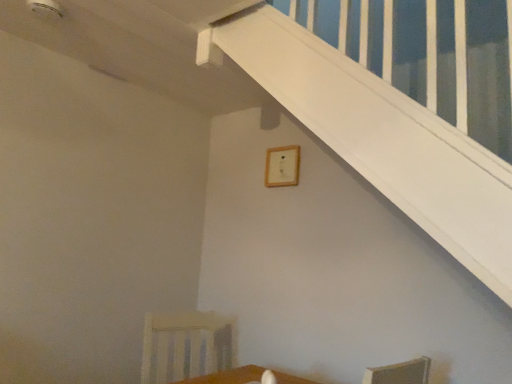
The height and width of the screenshot is (384, 512). Describe the element at coordinates (282, 166) in the screenshot. I see `wooden frame at upper center` at that location.

The image size is (512, 384). I want to click on wooden frame at upper center, so [282, 166].

I want to click on white wood armchair at lower left, so click(185, 346).

Image resolution: width=512 pixels, height=384 pixels. What do you see at coordinates (185, 346) in the screenshot?
I see `white wood armchair at lower left` at bounding box center [185, 346].

The image size is (512, 384). Find the location of `wooden frame at upper center`. wooden frame at upper center is located at coordinates (282, 166).

Based on their positions, is white wood armchair at lower left located to the left or right of wooden frame at upper center?

Based on their positions, white wood armchair at lower left is located to the left of wooden frame at upper center.

Considering the relative positions of white wood armchair at lower left and wooden frame at upper center in the image provided, is white wood armchair at lower left in front of wooden frame at upper center?

Yes, white wood armchair at lower left is closer to the viewer.

Considering the positions of point (214, 342) and point (279, 169), is point (214, 342) closer or farther from the camera than point (279, 169)?

Point (214, 342) is positioned farther from the camera compared to point (279, 169).

From the image's perspective, is white wood armchair at lower left above or below wooden frame at upper center?

white wood armchair at lower left is situated lower than wooden frame at upper center in the image.

From a real-world perspective, is white wood armchair at lower left above or below wooden frame at upper center?

Clearly, from a real-world perspective, white wood armchair at lower left is below wooden frame at upper center.

Based on the photo, between white wood armchair at lower left and wooden frame at upper center, which one has smaller width?

wooden frame at upper center is thinner.

Is white wood armchair at lower left taller or shorter than wooden frame at upper center?

Clearly, white wood armchair at lower left is taller compared to wooden frame at upper center.

Does white wood armchair at lower left have a smaller size compared to wooden frame at upper center?

Incorrect, white wood armchair at lower left is not smaller in size than wooden frame at upper center.

Do you think white wood armchair at lower left is within wooden frame at upper center, or outside of it?

The correct answer is: outside.

Would you say white wood armchair at lower left is a long distance from wooden frame at upper center?

That's right, there is a large distance between white wood armchair at lower left and wooden frame at upper center.

Is white wood armchair at lower left facing towards wooden frame at upper center?

No, white wood armchair at lower left is not facing towards wooden frame at upper center.

Where is `armchair below the wooden frame at upper center (from the image's perspective)`? The image size is (512, 384). armchair below the wooden frame at upper center (from the image's perspective) is located at coordinates (185, 346).

Is wooden frame at upper center to the left of white wood armchair at lower left from the viewer's perspective?

No.

Which object is further away from the camera, wooden frame at upper center or white wood armchair at lower left?

wooden frame at upper center is behind.

Which is closer, [298,157] or [225,324]?

Point [298,157].

From the image's perspective, is wooden frame at upper center above or below white wood armchair at lower left?

wooden frame at upper center is situated higher than white wood armchair at lower left in the image.

From a real-world perspective, who is located higher, wooden frame at upper center or white wood armchair at lower left?

wooden frame at upper center is physically above.

Considering the relative sizes of wooden frame at upper center and white wood armchair at lower left in the image provided, is wooden frame at upper center wider than white wood armchair at lower left?

No, wooden frame at upper center is not wider than white wood armchair at lower left.

Who is shorter, wooden frame at upper center or white wood armchair at lower left?

With less height is wooden frame at upper center.

Considering the relative sizes of wooden frame at upper center and white wood armchair at lower left in the image provided, is wooden frame at upper center bigger than white wood armchair at lower left?

Actually, wooden frame at upper center might be smaller than white wood armchair at lower left.

Is white wood armchair at lower left inside wooden frame at upper center?

Actually, white wood armchair at lower left is outside wooden frame at upper center.

Consider the image. Are wooden frame at upper center and white wood armchair at lower left making contact?

No, wooden frame at upper center is not beside white wood armchair at lower left.

Is wooden frame at upper center positioned with its back to white wood armchair at lower left?

No.

What's the angular difference between wooden frame at upper center and white wood armchair at lower left's facing directions?

There is a 78.3-degree angle between the facing directions of wooden frame at upper center and white wood armchair at lower left.

Identify the location of armchair below the wooden frame at upper center (from a real-world perspective). The height and width of the screenshot is (384, 512). (185, 346).

You are a GUI agent. You are given a task and a screenshot of the screen. Output one action in this format:
    pyautogui.click(x=<x>, y=<y>)
    Task: Click on the picture frame on the right of white wood armchair at lower left
    
    Given the screenshot: What is the action you would take?
    pyautogui.click(x=282, y=166)

Where is `armchair in front of the wooden frame at upper center`? armchair in front of the wooden frame at upper center is located at coordinates (185, 346).